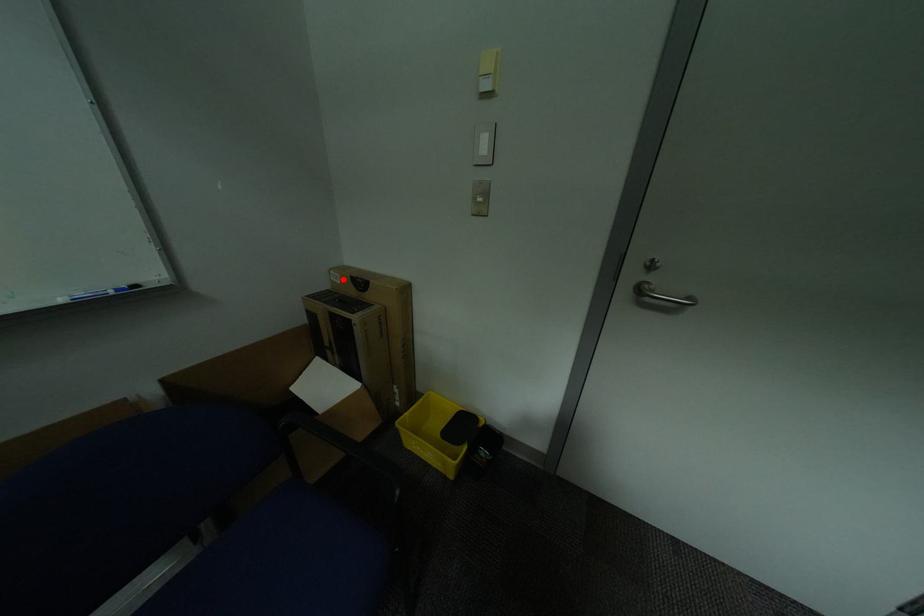
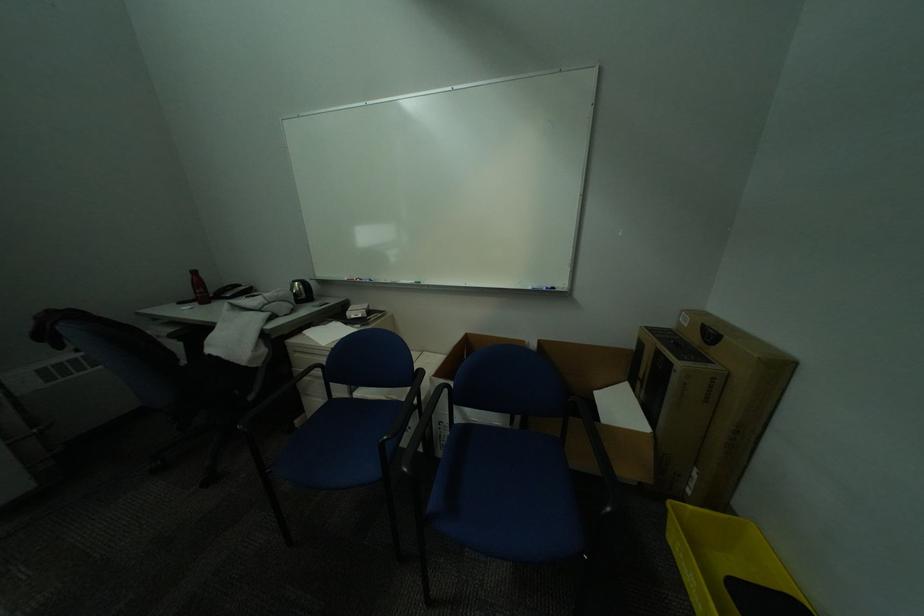
Question: I am providing you with two images of the same scene from different viewpoints. Given a red point in image1, look at the same physical point in image2. Is it:

Choices:
 (A) Closer to the viewpoint
 (B) Farther from the viewpoint

Answer: (A)